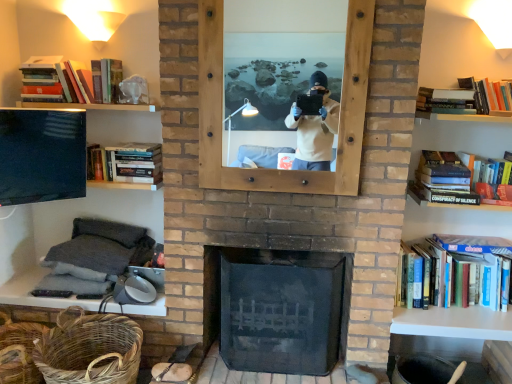
What are the coordinates of `free point below wooden mirror at center (from a real-world perspective)` in the screenshot? It's located at (269, 258).